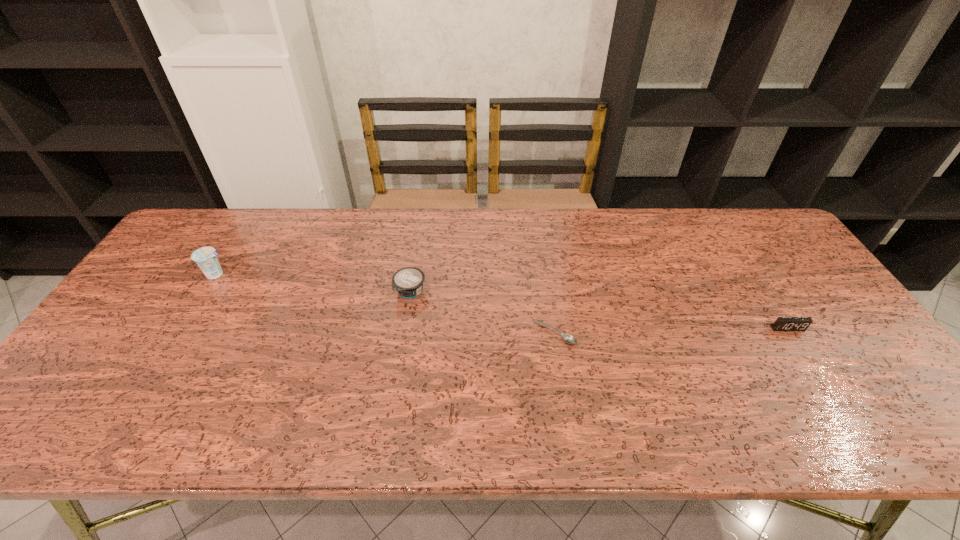
Where is `free region located on the front-facing side of the rightmost object`? free region located on the front-facing side of the rightmost object is located at coordinates (857, 437).

Find the location of a particular element. The width and height of the screenshot is (960, 540). vacant region located 0.180m on the right of the third object from left to right is located at coordinates tap(644, 333).

Locate an element on the screen. object located at the left edge is located at coordinates (205, 257).

This screenshot has width=960, height=540. I want to click on object located at the right edge, so click(782, 323).

I want to click on vacant space at the far edge of the desktop, so click(x=447, y=238).

Locate an element on the screen. The height and width of the screenshot is (540, 960). vacant space at the near edge of the desktop is located at coordinates (548, 420).

Where is `free space at the left edge of the desktop`? The width and height of the screenshot is (960, 540). free space at the left edge of the desktop is located at coordinates (182, 281).

This screenshot has width=960, height=540. Find the location of `vacant space at the right edge of the desktop`. vacant space at the right edge of the desktop is located at coordinates (823, 293).

I want to click on blank space at the far left corner, so click(x=199, y=233).

Find the location of a particular element. This screenshot has width=960, height=540. vacant area that lies between the left yogurt and the third tallest object is located at coordinates (502, 301).